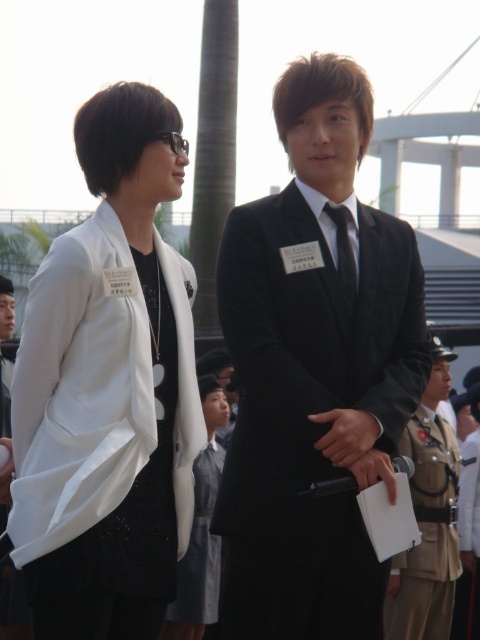
Which is above, khaki uniform at lower right or black satin tie at center?

Positioned higher is black satin tie at center.

The width and height of the screenshot is (480, 640). What do you see at coordinates (428, 516) in the screenshot?
I see `khaki uniform at lower right` at bounding box center [428, 516].

This screenshot has height=640, width=480. What are the coordinates of `khaki uniform at lower right` in the screenshot? It's located at (428, 516).

Measure the distance between black velvet suit at center and black satin tie at center.

black velvet suit at center is 20.47 feet from black satin tie at center.

Measure the distance between point (361, 552) and camera.

The distance of point (361, 552) from camera is 198.19 feet.

Where is `black velvet suit at center`? The height and width of the screenshot is (640, 480). black velvet suit at center is located at coordinates (313, 372).

This screenshot has width=480, height=640. Find the location of `black velvet suit at center`. black velvet suit at center is located at coordinates (313, 372).

In order to click on white matte blazer at left in this screenshot , I will do `click(108, 388)`.

Can you confirm if white matte blazer at left is positioned below khaki uniform at lower right?

No.

Is point (31, 540) farther from viewer compared to point (389, 572)?

No, (31, 540) is closer to viewer.

I want to click on white matte blazer at left, so click(108, 388).